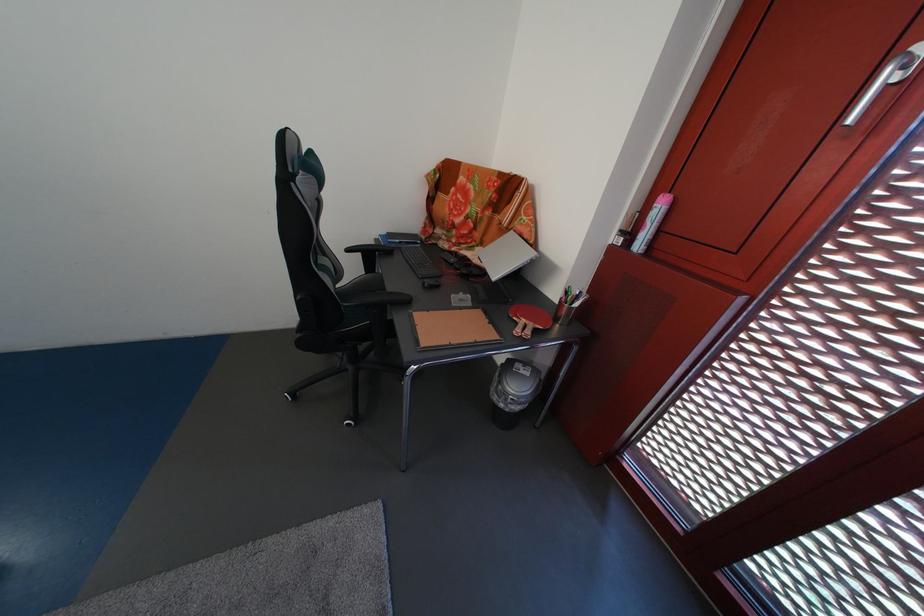
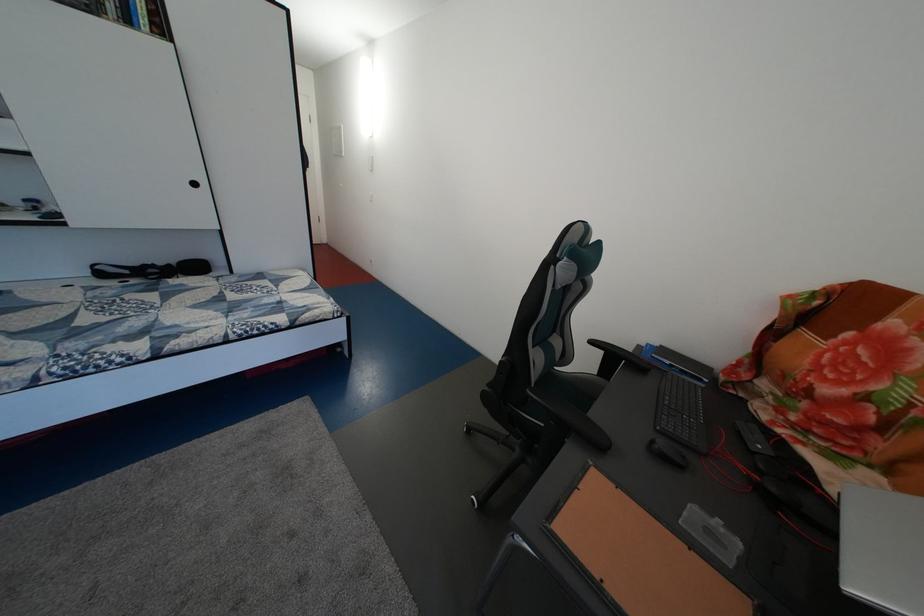
Question: Based on the continuous images, in which direction is the camera rotating? Reply with the corresponding letter.

Choices:
 (A) Left
 (B) Right
 (C) Up
 (D) Down

Answer: (A)